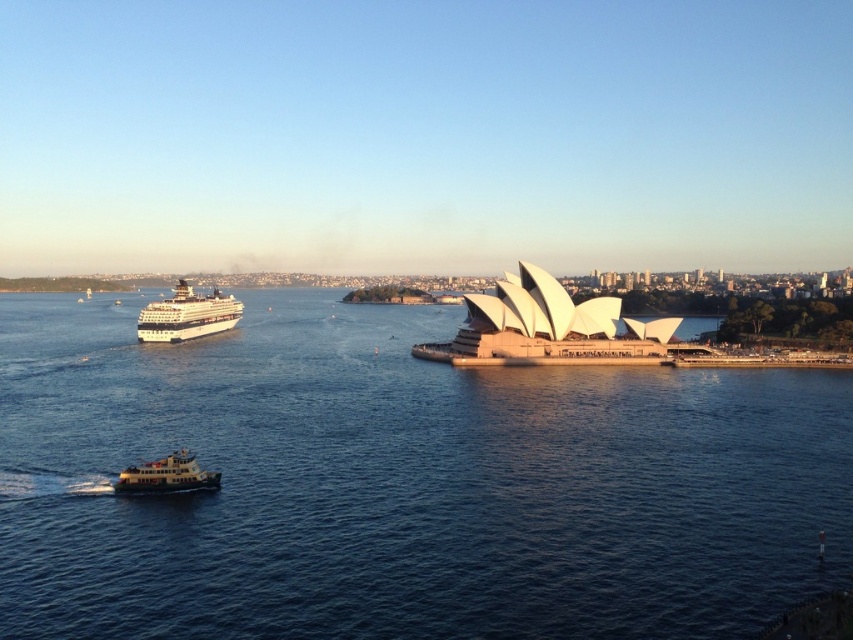
Question: Which of the following is the farthest from the observer?

Choices:
 (A) (181, 333)
 (B) (183, 464)

Answer: (A)

Question: Is blue water at center further to the viewer compared to white matte ferry at lower left?

Choices:
 (A) no
 (B) yes

Answer: (A)

Question: Which point appears farthest from the camera in this image?

Choices:
 (A) (146, 332)
 (B) (190, 484)

Answer: (A)

Question: Does blue water at center have a smaller size compared to white glossy cruise ship at left?

Choices:
 (A) no
 (B) yes

Answer: (A)

Question: Which point is closer to the camera taking this photo?

Choices:
 (A) (90, 573)
 (B) (183, 477)
 (C) (138, 339)

Answer: (A)

Question: Observing the image, what is the correct spatial positioning of white glossy cruise ship at left in reference to white matte ferry at lower left?

Choices:
 (A) left
 (B) right

Answer: (A)